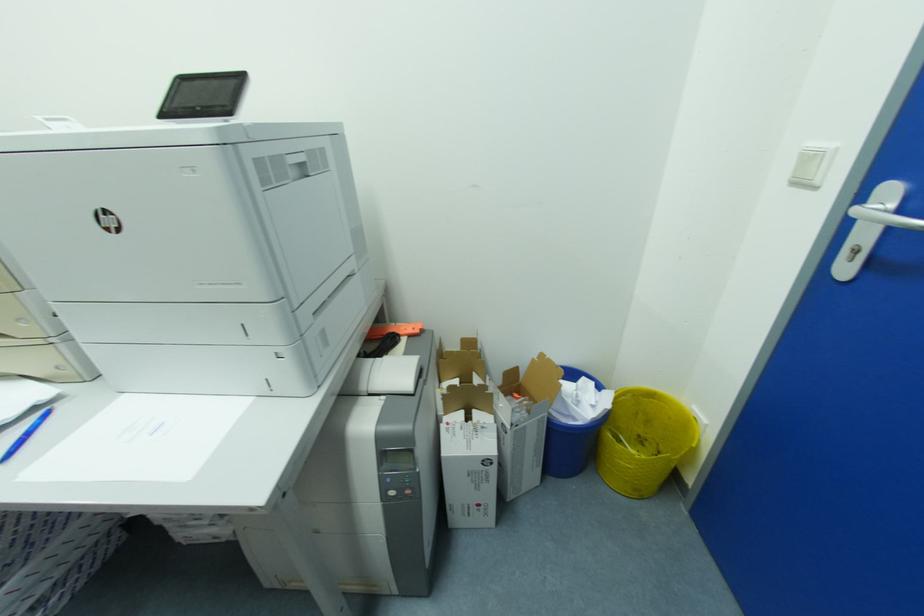
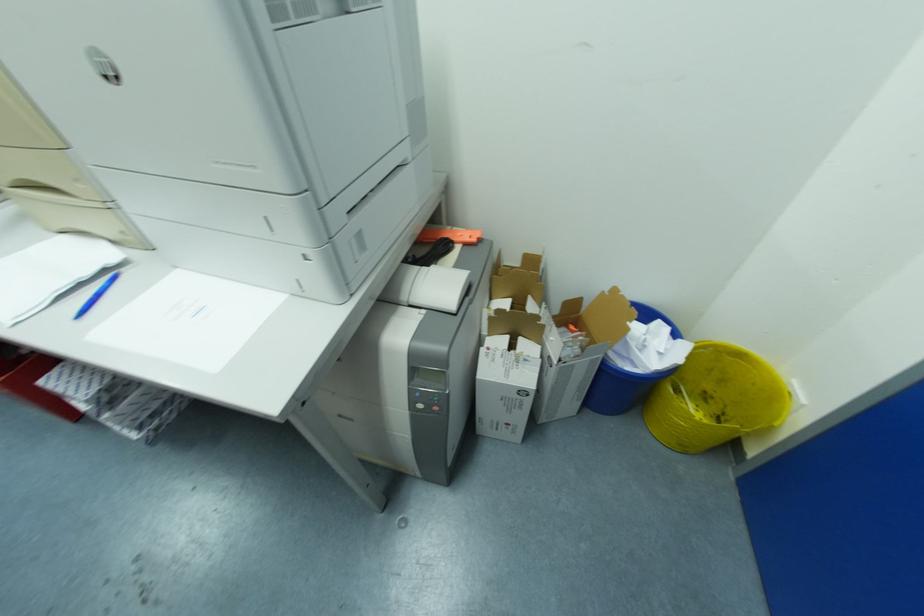
Question: What movement of the cameraman would produce the second image?

Choices:
 (A) Left
 (B) Right
 (C) Forward
 (D) Backward

Answer: (C)